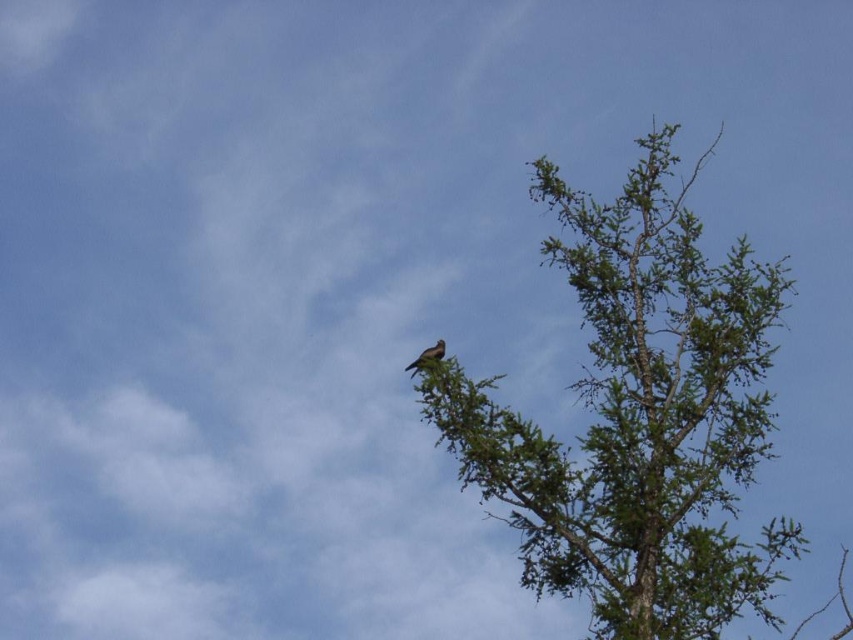
Question: Does green textured tree at upper right appear over brown feathered bird at upper center?

Choices:
 (A) yes
 (B) no

Answer: (B)

Question: Which point is closer to the camera?

Choices:
 (A) (440, 348)
 (B) (438, 369)

Answer: (B)

Question: Among these points, which one is nearest to the camera?

Choices:
 (A) (408, 369)
 (B) (462, 449)

Answer: (A)

Question: In this image, where is green textured tree at upper right located relative to brown feathered bird at upper center?

Choices:
 (A) below
 (B) above

Answer: (A)

Question: Can you confirm if green textured tree at upper right is thinner than brown feathered bird at upper center?

Choices:
 (A) yes
 (B) no

Answer: (B)